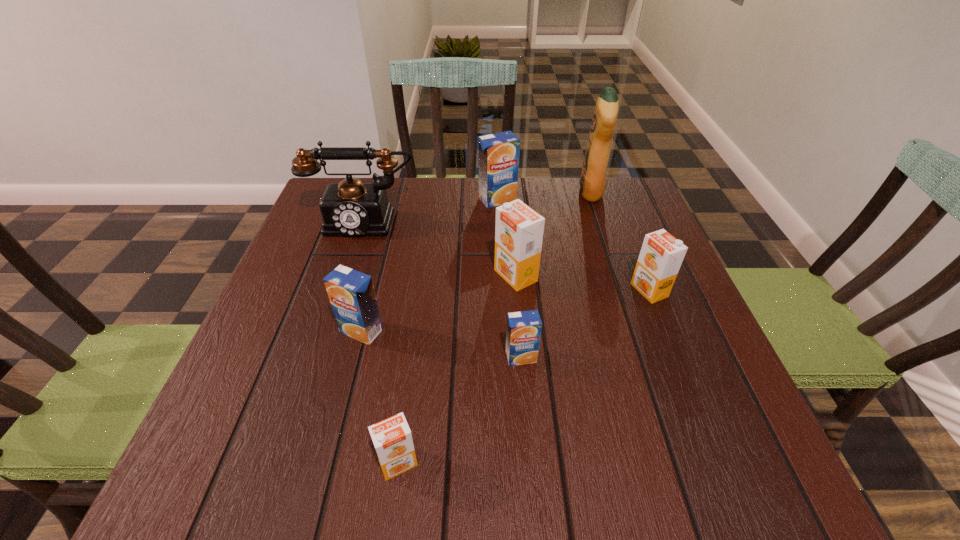
Where is `blank area located 0.170m on the right of the leftmost orange juice`? The width and height of the screenshot is (960, 540). blank area located 0.170m on the right of the leftmost orange juice is located at coordinates (469, 331).

The width and height of the screenshot is (960, 540). Find the location of `vacant space situated 0.090m on the back of the rightmost orange orange juice`. vacant space situated 0.090m on the back of the rightmost orange orange juice is located at coordinates (634, 252).

At what (x,y) coordinates should I click in order to perform the action: click on vacant space located 0.390m on the back of the smallest blue orange_juice. Please return your answer as a coordinate pair (x, y). Looking at the image, I should click on (510, 226).

What are the coordinates of `vacant space located 0.170m on the left of the fifth orange juice from right to left` in the screenshot? It's located at coord(268,463).

Locate an element on the screen. The width and height of the screenshot is (960, 540). detergent that is positioned at the far edge is located at coordinates (593, 174).

Find the location of a particular element. telephone that is at the far edge is located at coordinates (350, 208).

In order to click on orange_juice present at the far edge in this screenshot , I will do `click(498, 153)`.

What are the coordinates of `object that is positioned at the near edge` in the screenshot? It's located at (392, 438).

What are the coordinates of `object that is at the left edge` in the screenshot? It's located at (350, 208).

This screenshot has height=540, width=960. In order to click on detergent that is positioned at the right edge in this screenshot , I will do `click(593, 174)`.